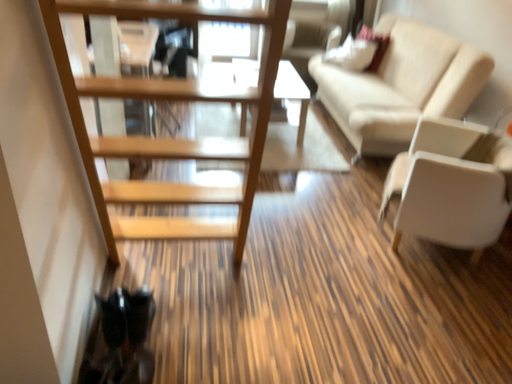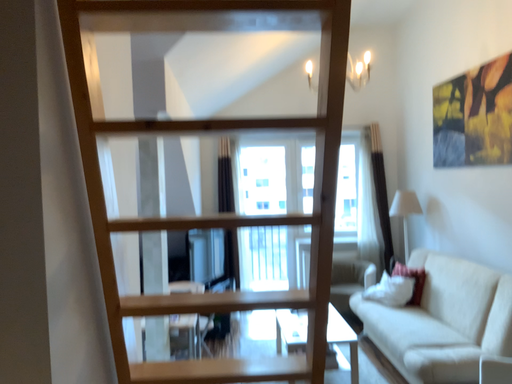
Question: How did the camera likely rotate when shooting the video?

Choices:
 (A) rotated upward
 (B) rotated downward

Answer: (A)